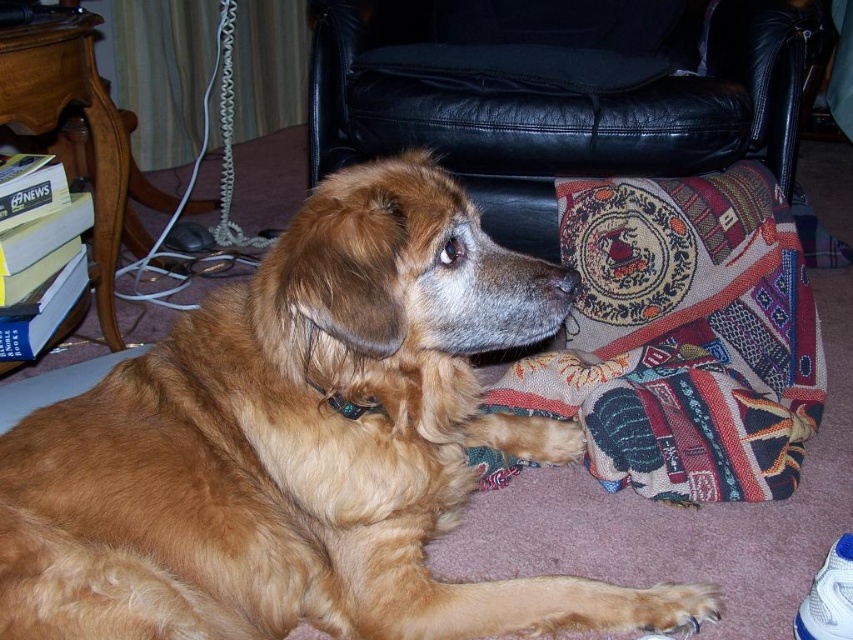
You are standing in a living room and see the golden fur dog at center and the black leather armchair at upper center. Which object is positioned to the left of the other?

The golden fur dog at center is to the left of the black leather armchair at upper center.

You are trying to decide if the golden fur dog at center can fit through the gap between the black leather armchair at upper center and the wall. Based on their sizes, can the dog fit through the gap?

The golden fur dog at center has a lesser width compared to black leather armchair at upper center, so it is possible that the dog can fit through the gap if the space between the armchair and the wall is at least as wide as the dog.